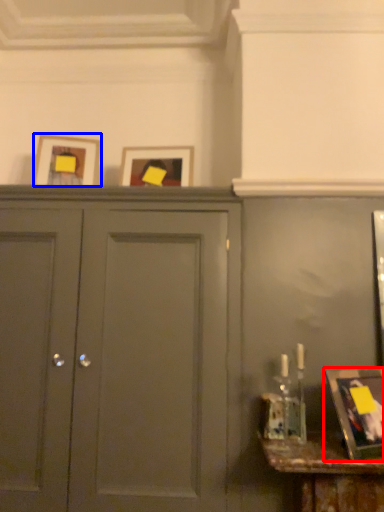
Question: Which of the following is the closest to the observer, picture frame (highlighted by a red box) or picture frame (highlighted by a blue box)?

Choices:
 (A) picture frame
 (B) picture frame

Answer: (A)